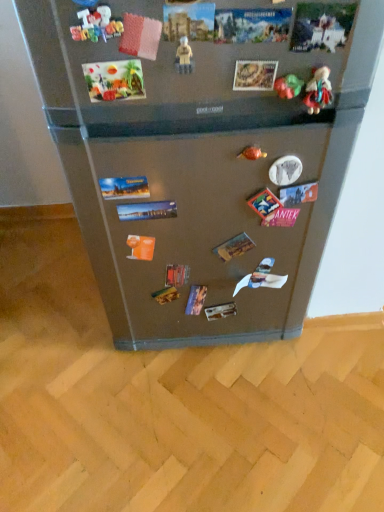
Question: Is green matte toy at upper right, the fourth toy viewed from the front, surrounded by satin metallic fridge at center?

Choices:
 (A) yes
 (B) no

Answer: (A)

Question: Considering the relative sizes of satin metallic fridge at center and green matte toy at upper right, the fourth toy viewed from the front, in the image provided, is satin metallic fridge at center taller than green matte toy at upper right, the fourth toy viewed from the front,?

Choices:
 (A) yes
 (B) no

Answer: (A)

Question: Is satin metallic fridge at center beside green matte toy at upper right, marked as the fourth toy in a left-to-right arrangement?

Choices:
 (A) yes
 (B) no

Answer: (B)

Question: Does satin metallic fridge at center have a larger size compared to green matte toy at upper right, which is counted as the second toy, starting from the back?

Choices:
 (A) no
 (B) yes

Answer: (B)

Question: Is the position of satin metallic fridge at center more distant than that of green matte toy at upper right, which is counted as the second toy, starting from the back?

Choices:
 (A) no
 (B) yes

Answer: (A)

Question: Is satin metallic fridge at center turned away from green matte toy at upper right, marked as the 2th toy in a right-to-left arrangement?

Choices:
 (A) no
 (B) yes

Answer: (B)

Question: Can you see plastic beige figure at center, which is the 2th toy in left-to-right order, touching multicolored fabric doll at upper right, which is the third toy in front-to-back order?

Choices:
 (A) yes
 (B) no

Answer: (B)

Question: From a real-world perspective, is plastic beige figure at center, the 4th toy viewed from the back, physically above multicolored fabric doll at upper right, which is the third toy in front-to-back order?

Choices:
 (A) yes
 (B) no

Answer: (A)

Question: Does plastic beige figure at center, which appears as the 2th toy when viewed from the front, have a greater width compared to multicolored fabric doll at upper right, marked as the 1th toy in a right-to-left arrangement?

Choices:
 (A) yes
 (B) no

Answer: (A)

Question: Is plastic beige figure at center, which appears as the 2th toy when viewed from the front, outside multicolored fabric doll at upper right, which is the third toy in front-to-back order?

Choices:
 (A) yes
 (B) no

Answer: (A)

Question: Does plastic beige figure at center, which is the 2th toy in left-to-right order, have a greater height compared to multicolored fabric doll at upper right, marked as the 1th toy in a right-to-left arrangement?

Choices:
 (A) yes
 (B) no

Answer: (B)

Question: Is plastic beige figure at center, acting as the fourth toy starting from the right, at the left side of multicolored fabric doll at upper right, marked as the 1th toy in a right-to-left arrangement?

Choices:
 (A) no
 (B) yes

Answer: (B)

Question: Considering the relative positions of green matte toy at upper right, the fourth toy viewed from the front, and multicolored fabric doll at upper right, marked as the 1th toy in a right-to-left arrangement, in the image provided, is green matte toy at upper right, the fourth toy viewed from the front, behind multicolored fabric doll at upper right, marked as the 1th toy in a right-to-left arrangement,?

Choices:
 (A) yes
 (B) no

Answer: (A)